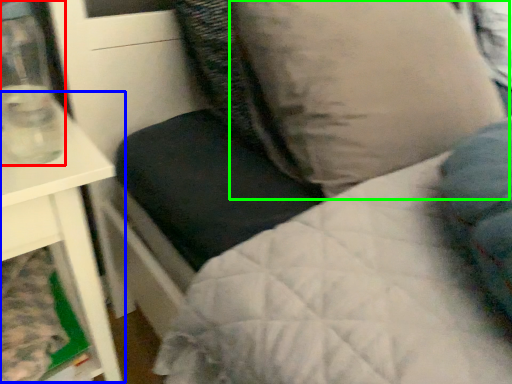
Question: Which object is the closest to the glass vase (highlighted by a red box)? Choose among these: table (highlighted by a blue box) or pillow (highlighted by a green box).

Choices:
 (A) table
 (B) pillow

Answer: (A)